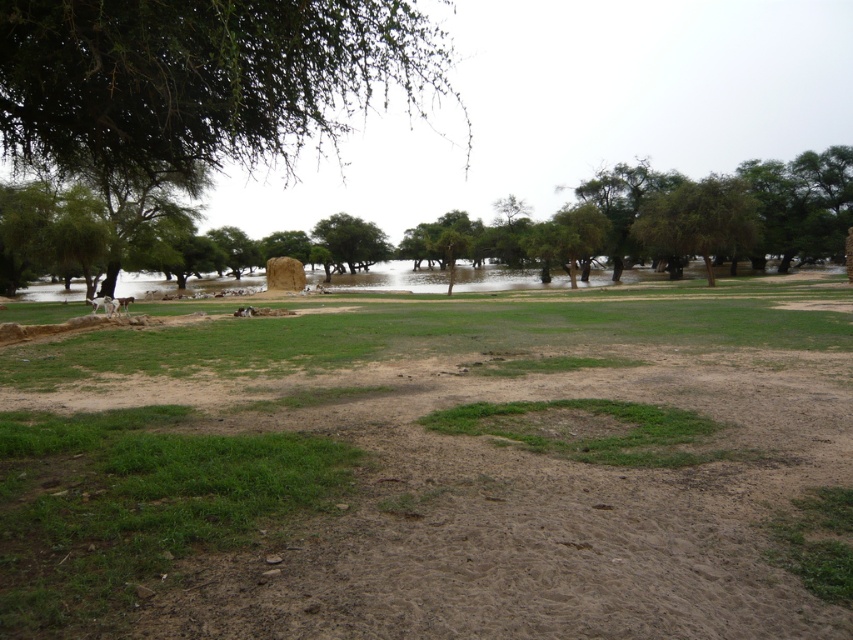
Question: Is green leafy tree at upper left below white fur dog at center?

Choices:
 (A) yes
 (B) no

Answer: (B)

Question: Which point is closer to the camera taking this photo?

Choices:
 (A) (258, 6)
 (B) (419, 492)
 (C) (349, 272)

Answer: (A)

Question: Which of the following is the closest to the observer?

Choices:
 (A) (440, 234)
 (B) (606, 310)
 (C) (206, 20)
 (D) (334, 230)

Answer: (C)

Question: Does brown/dry dirt field at center have a greater width compared to green leafy tree at center?

Choices:
 (A) no
 (B) yes

Answer: (B)

Question: Is brown/dry dirt field at center thinner than green leafy tree at upper center?

Choices:
 (A) yes
 (B) no

Answer: (A)

Question: Which point is closer to the camera taking this photo?

Choices:
 (A) (99, 304)
 (B) (339, 262)
 (C) (579, 506)

Answer: (C)